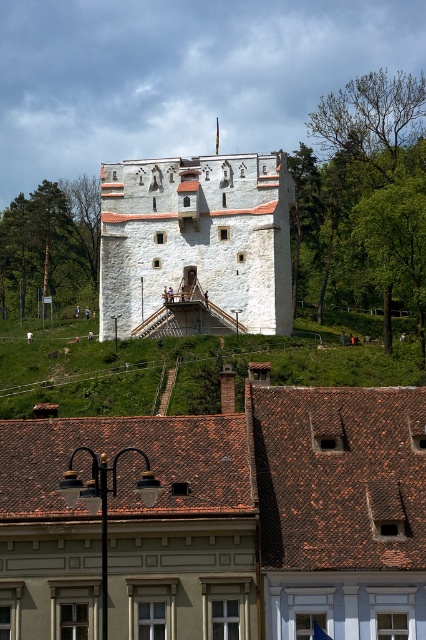
Question: Where is green leafy tree at upper center located in relation to green leafy tree at left in the image?

Choices:
 (A) below
 (B) above

Answer: (B)

Question: Among these objects, which one is farthest from the camera?

Choices:
 (A) green leafy tree at upper center
 (B) white stone tower at center
 (C) green leafy tree at left

Answer: (C)

Question: Does white stone tower at center have a larger size compared to green leafy tree at left?

Choices:
 (A) yes
 (B) no

Answer: (B)

Question: Among these objects, which one is nearest to the camera?

Choices:
 (A) green leafy tree at upper center
 (B) green leafy tree at left

Answer: (A)

Question: Can you confirm if green leafy tree at upper center is positioned below green leafy tree at left?

Choices:
 (A) yes
 (B) no

Answer: (B)

Question: Which object is positioned farthest from the white stone tower at center?

Choices:
 (A) green leafy tree at left
 (B) green leafy tree at upper center

Answer: (A)